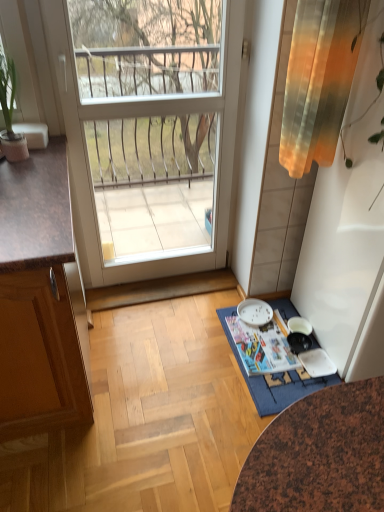
The image size is (384, 512). In order to click on vacant region to the left of blue fabric doormat at lower center in this screenshot , I will do `click(176, 382)`.